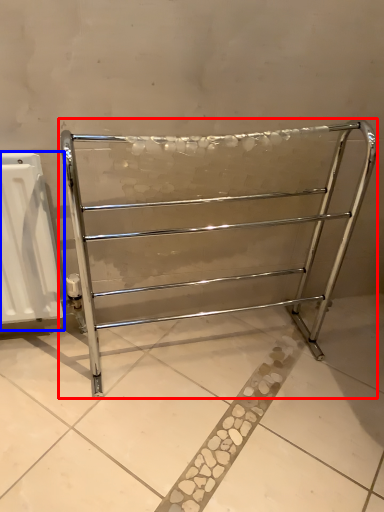
Question: Among these objects, which one is nearest to the camera, furniture (highlighted by a red box) or radiator (highlighted by a blue box)?

Choices:
 (A) furniture
 (B) radiator

Answer: (A)